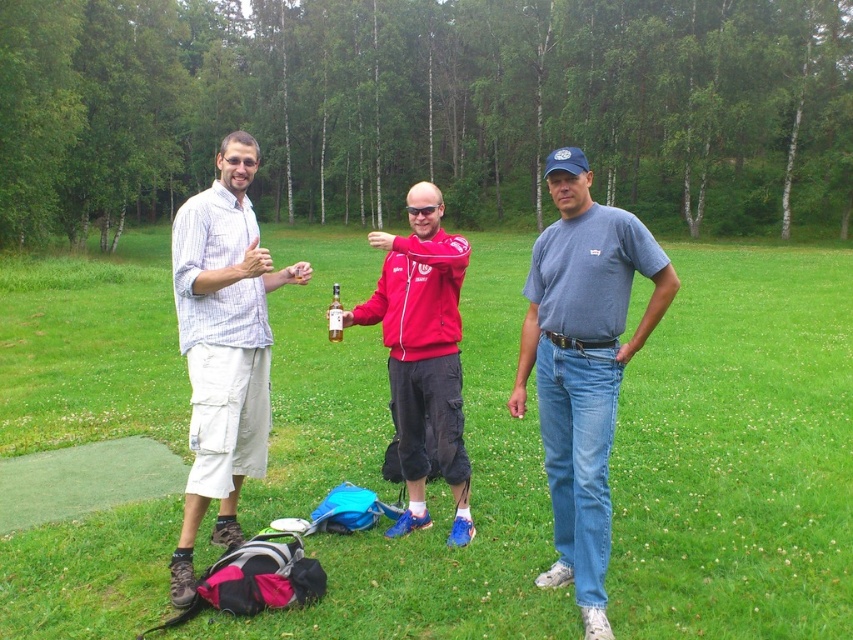
You are planning to take a photo of the two central figures in the scene. The denim jeans at center and the matte red jacket at center are both in the frame. Based on their sizes, which one would you focus on first to ensure it fits entirely within the camera viewfinder?

The denim jeans at center has a larger width than the matte red jacket at center, so you should focus on ensuring the denim jeans at center fits first since it occupies more space.

You are planning to set up a picnic blanket in the grassy area. Considering the green grass at center and the matte red jacket at center, which object is taller and would allow the blanket to be placed without obstruction?

The green grass at center is taller than the matte red jacket at center. Therefore, the blanket should be placed away from the green grass at center to avoid obstruction.

Based on the photo, you are a photographer planning to take a group photo of the striped cotton shirt at left and the matte red jacket at center. Based on their positions, which person should stand in front to ensure both are fully visible in the photo?

The matte red jacket at center should stand in front because the striped cotton shirt at left is located below it, meaning the striped cotton shirt at left is currently behind the matte red jacket at center.